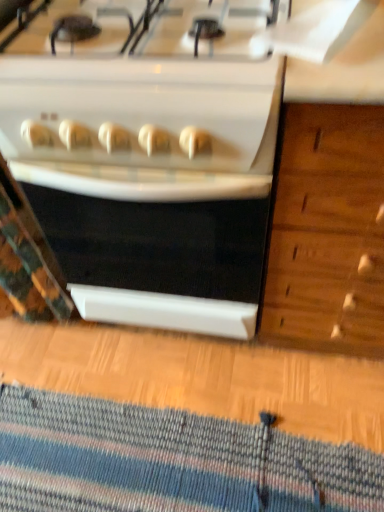
Question: Can you confirm if white glossy stove at center is bigger than striped wool doormat at lower center?

Choices:
 (A) yes
 (B) no

Answer: (A)

Question: Considering the relative sizes of white glossy stove at center and striped wool doormat at lower center in the image provided, is white glossy stove at center taller than striped wool doormat at lower center?

Choices:
 (A) yes
 (B) no

Answer: (A)

Question: Is white glossy stove at center not near striped wool doormat at lower center?

Choices:
 (A) yes
 (B) no

Answer: (B)

Question: Considering the relative sizes of white glossy stove at center and striped wool doormat at lower center in the image provided, is white glossy stove at center shorter than striped wool doormat at lower center?

Choices:
 (A) no
 (B) yes

Answer: (A)

Question: Can you confirm if white glossy stove at center is positioned to the right of striped wool doormat at lower center?

Choices:
 (A) no
 (B) yes

Answer: (B)

Question: From a real-world perspective, is white glossy stove at center beneath striped wool doormat at lower center?

Choices:
 (A) no
 (B) yes

Answer: (A)

Question: Does striped wool doormat at lower center have a smaller size compared to white glossy stove at center?

Choices:
 (A) yes
 (B) no

Answer: (A)

Question: Is the surface of striped wool doormat at lower center in direct contact with white glossy stove at center?

Choices:
 (A) no
 (B) yes

Answer: (A)

Question: Is striped wool doormat at lower center outside white glossy stove at center?

Choices:
 (A) yes
 (B) no

Answer: (A)

Question: Can you confirm if striped wool doormat at lower center is bigger than white glossy stove at center?

Choices:
 (A) no
 (B) yes

Answer: (A)

Question: Is striped wool doormat at lower center positioned in front of white glossy stove at center?

Choices:
 (A) no
 (B) yes

Answer: (A)

Question: Is white glossy stove at center inside striped wool doormat at lower center?

Choices:
 (A) yes
 (B) no

Answer: (B)

Question: In terms of width, does striped wool doormat at lower center look wider or thinner when compared to white glossy stove at center?

Choices:
 (A) wide
 (B) thin

Answer: (B)